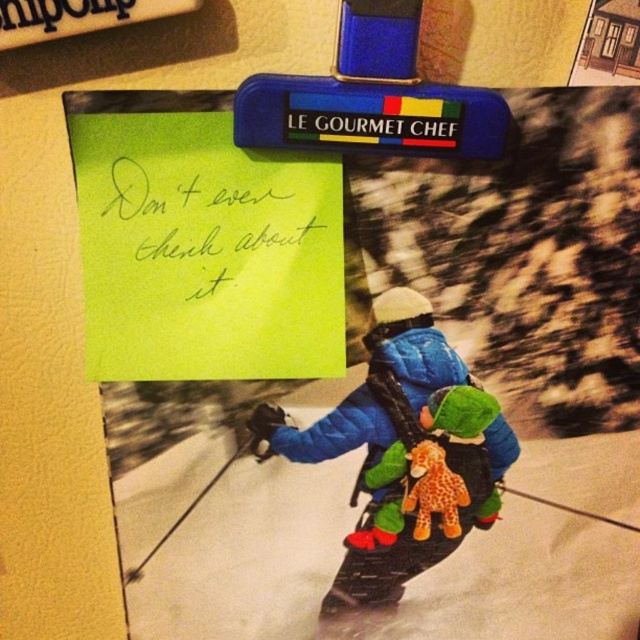
You are organizing a winter sports exhibition and need to arrange items from the collage. The blue quilted jacket at center and the yellow paper at upper left must be placed on a shelf. Which item should be placed first to ensure proper alignment with their original positions in the collage?

The yellow paper at upper left should be placed first because in the original collage, the blue quilted jacket at center is below the yellow paper at upper left, so positioning the yellow paper at upper left first maintains their vertical relationship.

You are organizing a winter sports exhibition and need to place the yellow paper at upper left and the soft plush giraffe at center in a way that maintains their original positions relative to each other. If you want to hang both items on a wall, which item should you place higher up?

The yellow paper at upper left should be placed higher up because it is located above the soft plush giraffe at center according to the description.

You are an interior designer assessing the collage on the wall. You need to place a new decorative item exactly at the point marked by the coordinates point (x=403, y=452). Where on the collage will this point be located?

The point (x=403, y=452) is on the blue quilted jacket at center, so placing the new decorative item there would position it directly on the jacket in the central photograph of the collage.